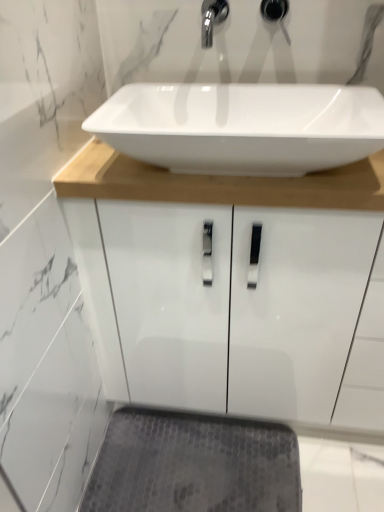
Question: From their relative heights in the image, would you say white glossy sink at center is taller or shorter than gray textured bath mat at lower center?

Choices:
 (A) tall
 (B) short

Answer: (A)

Question: From a real-world perspective, is white glossy sink at center physically located above or below gray textured bath mat at lower center?

Choices:
 (A) below
 (B) above

Answer: (B)

Question: Which object is the farthest from the matte black faucet at upper center?

Choices:
 (A) gray textured bath mat at lower center
 (B) white glossy sink at center

Answer: (A)

Question: Considering the real-world distances, which object is farthest from the matte black faucet at upper center?

Choices:
 (A) gray textured bath mat at lower center
 (B) white glossy sink at center

Answer: (A)